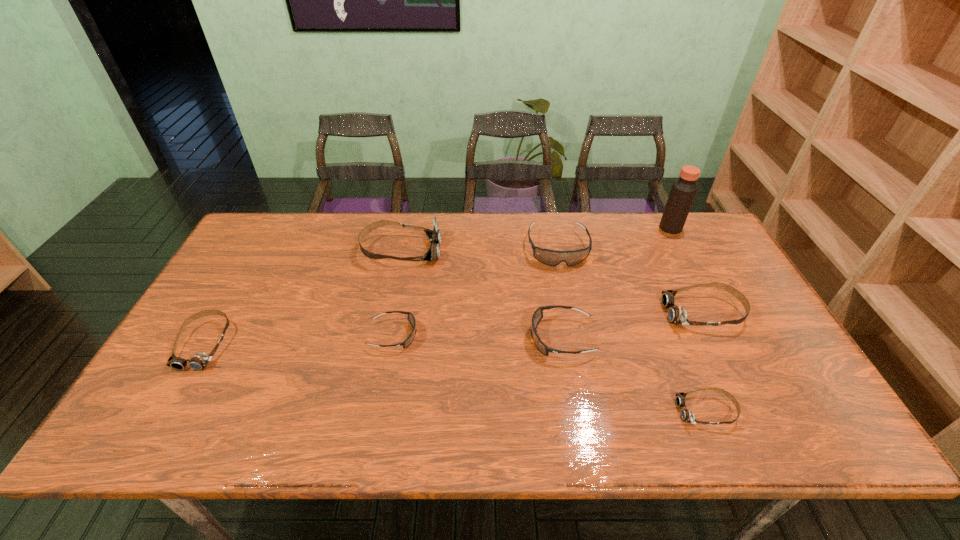
Find the location of `vacant region located 0.360m on the lenses of the second biggest black goggles`. vacant region located 0.360m on the lenses of the second biggest black goggles is located at coordinates (393, 338).

Locate an element on the screen. The height and width of the screenshot is (540, 960). free spot located on the front-facing side of the leftmost brown goggles is located at coordinates (156, 427).

Where is `free location located 0.240m on the lenses of the smallest black goggles`? This screenshot has height=540, width=960. free location located 0.240m on the lenses of the smallest black goggles is located at coordinates (508, 335).

This screenshot has width=960, height=540. I want to click on free space located on the front-facing side of the smallest brown goggles, so click(x=551, y=411).

Locate an element on the screen. free space located 0.080m on the front-facing side of the smallest brown goggles is located at coordinates (643, 411).

Find the location of a particular element. free region located on the front-facing side of the smallest brown goggles is located at coordinates (508, 411).

This screenshot has height=540, width=960. I want to click on vinegar at the far edge, so click(x=683, y=191).

What are the coordinates of `object located at the near edge` in the screenshot? It's located at (686, 415).

Find the location of a particular element. This screenshot has height=540, width=960. object that is at the left edge is located at coordinates (199, 361).

At what (x,y) coordinates should I click in order to perform the action: click on vinegar positioned at the right edge. Please return your answer as a coordinate pair (x, y). Looking at the image, I should click on (683, 191).